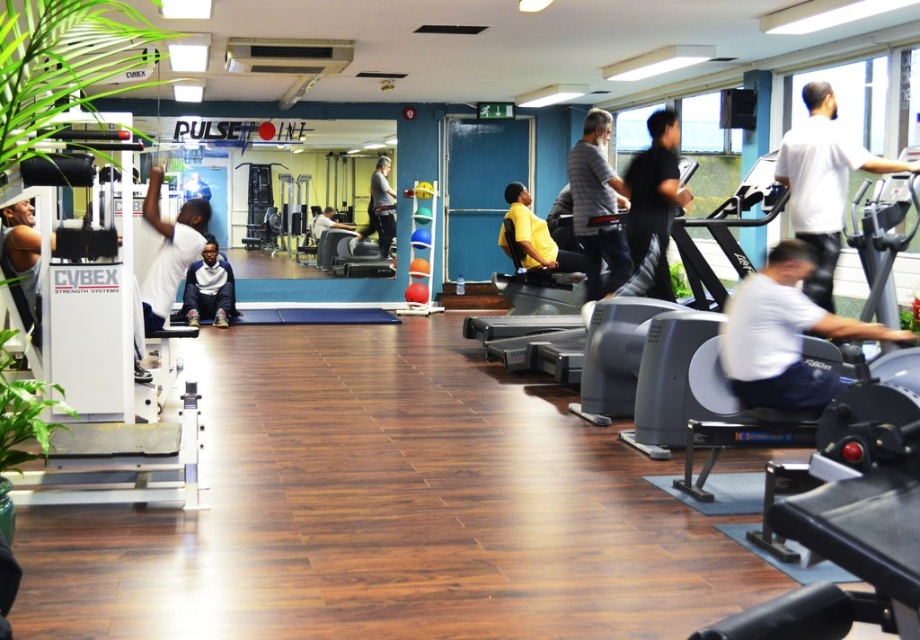
Question: Which point is closer to the camera?

Choices:
 (A) (29, 221)
 (B) (323, 220)
 (C) (508, 358)
 (D) (178, 422)

Answer: (A)

Question: Does gray cotton shirt at center appear over dark gray sweater at center?

Choices:
 (A) yes
 (B) no

Answer: (B)

Question: Which point is farther to the camera?

Choices:
 (A) (510, 243)
 (B) (145, 200)
 (C) (170, 305)
 (D) (190, 180)

Answer: (D)

Question: In this image, where is gray cotton shirt at center located relative to white matte shirt at left?

Choices:
 (A) below
 (B) above

Answer: (B)

Question: Which point is closer to the camera?

Choices:
 (A) (581, 266)
 (B) (211, 282)
 (C) (322, 224)
 (D) (583, 224)

Answer: (D)

Question: Where is white matte shirt at left located in relation to dark gray sweater at center in the image?

Choices:
 (A) left
 (B) right

Answer: (A)